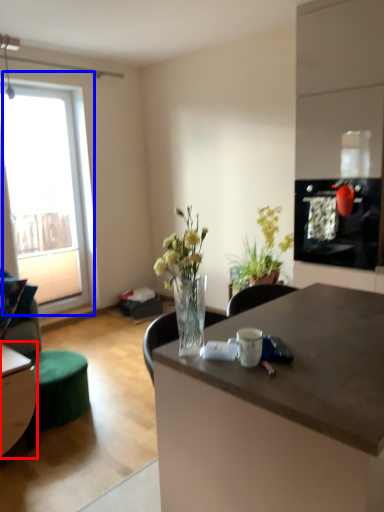
Question: Which object is further to the camera taking this photo, table (highlighted by a red box) or window (highlighted by a blue box)?

Choices:
 (A) table
 (B) window

Answer: (B)